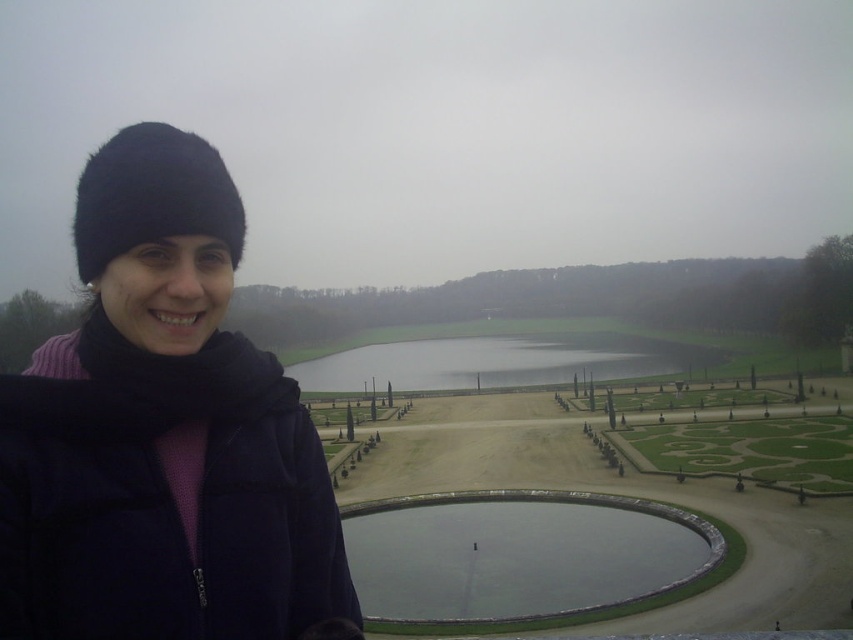
Who is higher up, dark blue fleece jacket at left or black fur hat at left?

Positioned higher is black fur hat at left.

Is dark blue fleece jacket at left above black fur hat at left?

No, dark blue fleece jacket at left is not above black fur hat at left.

Is point (273, 634) positioned behind point (140, 227)?

Yes, point (273, 634) is farther from viewer.

Image resolution: width=853 pixels, height=640 pixels. I want to click on dark blue fleece jacket at left, so click(x=164, y=499).

Can you confirm if black fur hat at left is positioned below glossy concrete pond at center?

No.

Locate an element on the screen. black fur hat at left is located at coordinates (152, 195).

Describe the element at coordinates (152, 195) in the screenshot. I see `black fur hat at left` at that location.

Locate an element on the screen. black fur hat at left is located at coordinates (152, 195).

Does clear glass pond at center appear under glossy concrete pond at center?

Indeed, clear glass pond at center is positioned under glossy concrete pond at center.

Describe the element at coordinates (520, 557) in the screenshot. I see `clear glass pond at center` at that location.

The image size is (853, 640). In order to click on clear glass pond at center in this screenshot , I will do `click(520, 557)`.